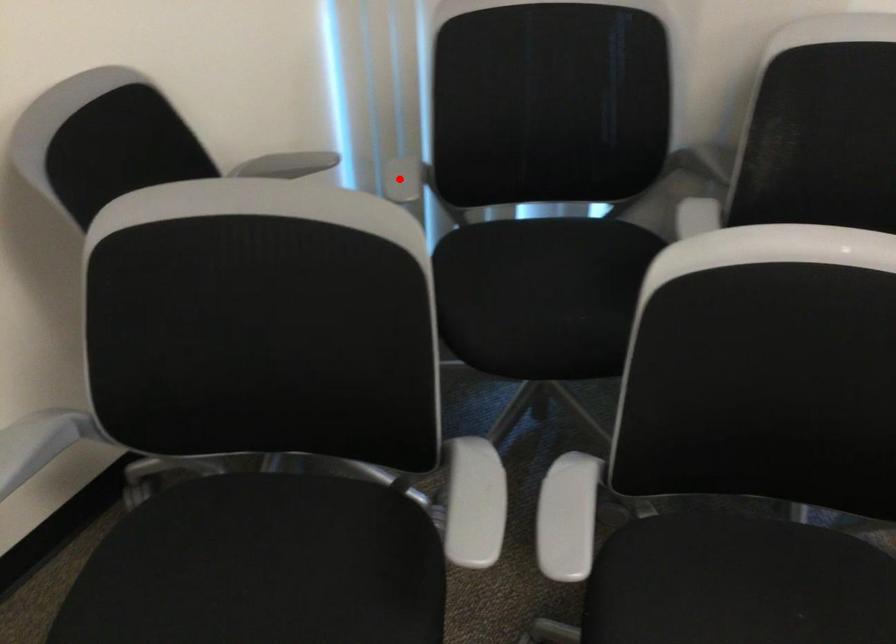
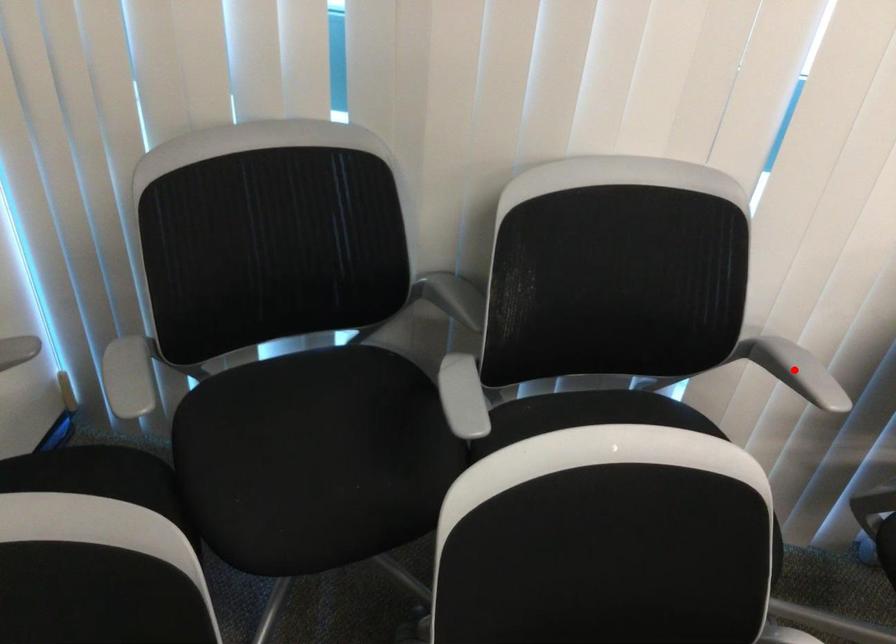
I am providing you with two images of the same scene from different viewpoints. A red point is marked on the first image and another point is marked on the second image. Does the point marked in image1 correspond to the same location as the one in image2?

No